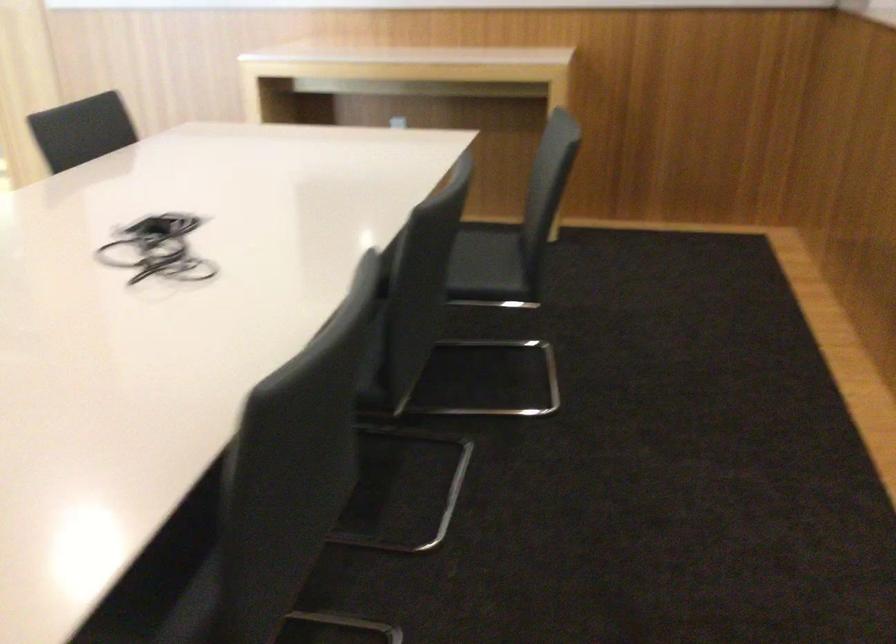
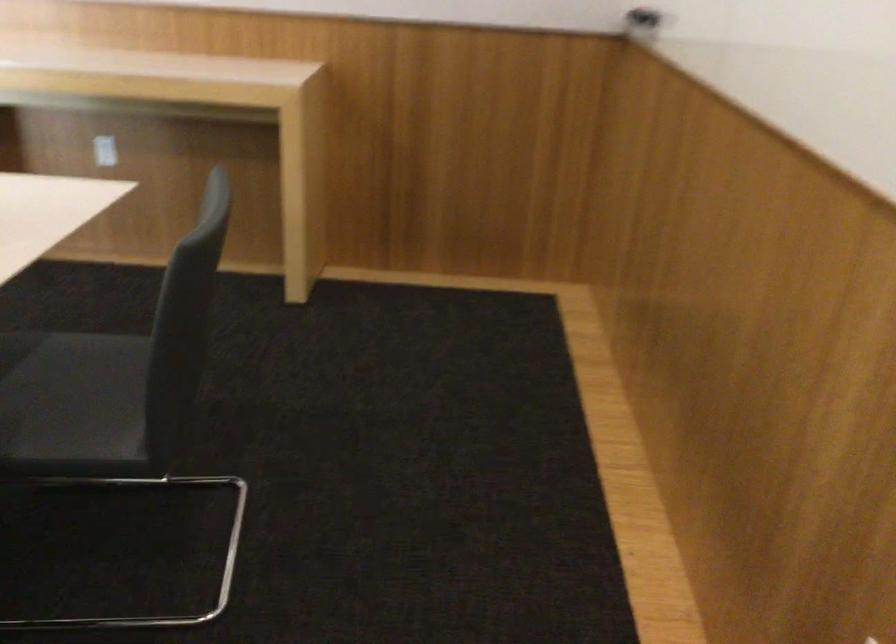
Question: The images are taken continuously from a first-person perspective. In which direction is your viewpoint rotating?

Choices:
 (A) Left
 (B) Right
 (C) Up
 (D) Down

Answer: (B)